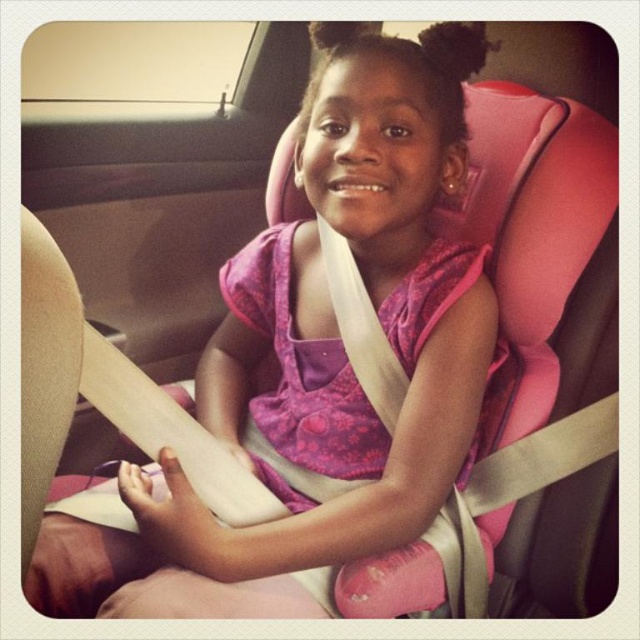
Question: Which point is farther from the camera taking this photo?

Choices:
 (A) (477, 532)
 (B) (296, 177)

Answer: (B)

Question: Where is pink fabric dress at center located in relation to beige fabric seatbelt at center in the image?

Choices:
 (A) below
 (B) above

Answer: (B)

Question: Is pink fabric dress at center positioned behind beige fabric seatbelt at center?

Choices:
 (A) yes
 (B) no

Answer: (B)

Question: Which point appears farthest from the camera in this image?

Choices:
 (A) (493, 326)
 (B) (368, 312)

Answer: (B)

Question: Observing the image, what is the correct spatial positioning of pink fabric dress at center in reference to beige fabric seatbelt at center?

Choices:
 (A) left
 (B) right

Answer: (A)